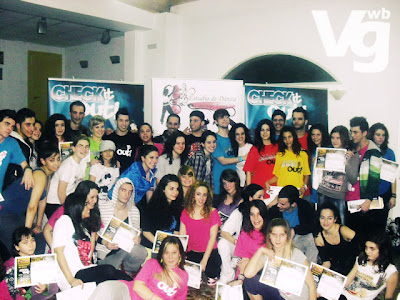
Locate an element on the screen. Image resolution: width=400 pixels, height=300 pixels. wall is located at coordinates (235, 41).